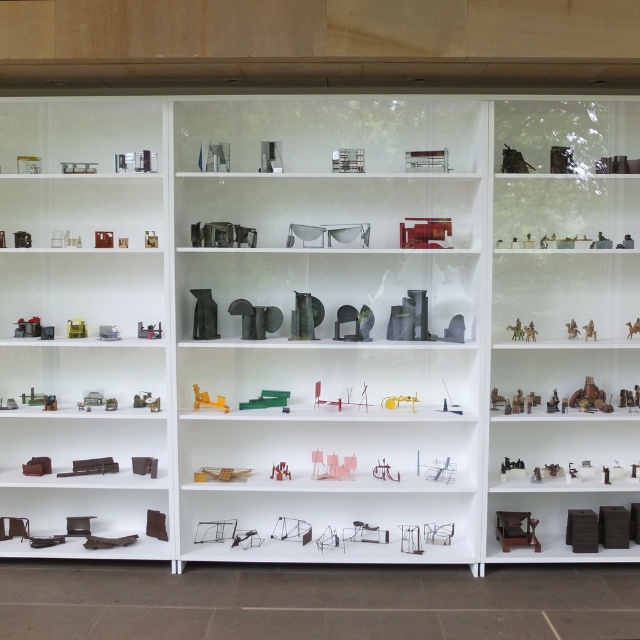
Question: Is brown matte furniture at lower left wider than metallic gold camel at center?

Choices:
 (A) no
 (B) yes

Answer: (B)

Question: Which point is farther to the camera?

Choices:
 (A) metallic gold camel at center
 (B) brown matte furniture at lower left

Answer: (A)

Question: Among these objects, which one is farthest from the camera?

Choices:
 (A) green matte toy car at center
 (B) metallic red toy airplane at center

Answer: (A)

Question: Can you confirm if metallic sculpture at center is positioned below yellow plastic toy at center?

Choices:
 (A) yes
 (B) no

Answer: (B)

Question: Observing the image, what is the correct spatial positioning of metallic yellow toy at center in reference to metallic gold camel at center?

Choices:
 (A) above
 (B) below

Answer: (B)

Question: Which point is closer to the camera?

Choices:
 (A) (259, 400)
 (B) (637, 326)

Answer: (B)